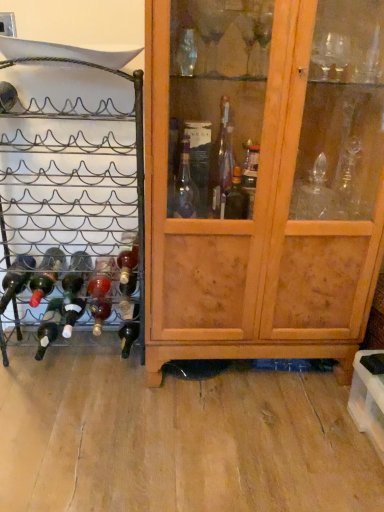
Image resolution: width=384 pixels, height=512 pixels. Identify the location of vacant space in front of black metal wine rack at left. (72, 410).